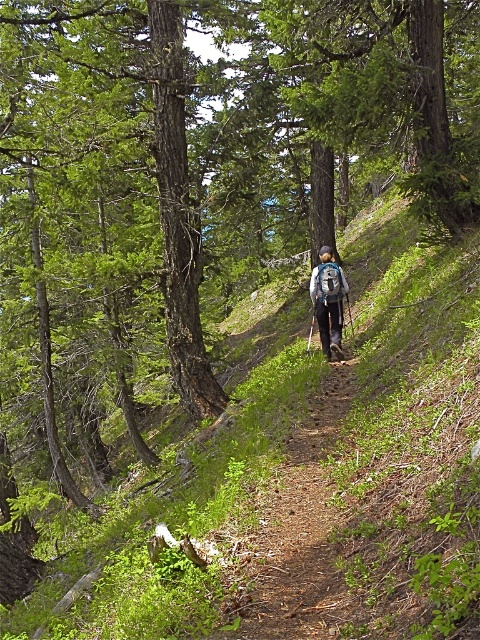
Question: Does brown dirt path at center have a smaller size compared to blue fabric backpack at center?

Choices:
 (A) yes
 (B) no

Answer: (B)

Question: Which point is closer to the camera?

Choices:
 (A) click(x=326, y=289)
 (B) click(x=262, y=602)

Answer: (B)

Question: Considering the relative positions of brown dirt path at center and blue fabric backpack at center in the image provided, where is brown dirt path at center located with respect to blue fabric backpack at center?

Choices:
 (A) above
 (B) below

Answer: (B)

Question: Is brown dirt path at center smaller than blue fabric backpack at center?

Choices:
 (A) yes
 (B) no

Answer: (B)

Question: Which object appears closest to the camera in this image?

Choices:
 (A) blue fabric backpack at center
 (B) brown dirt path at center

Answer: (B)